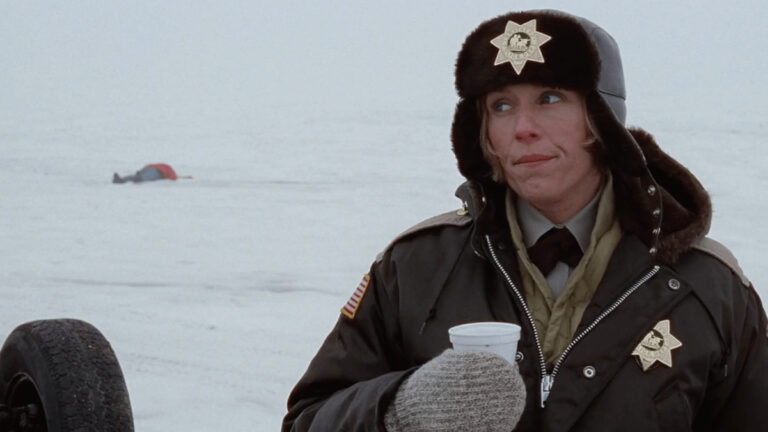
Locate an element on the screen. cup is located at coordinates (511, 342).